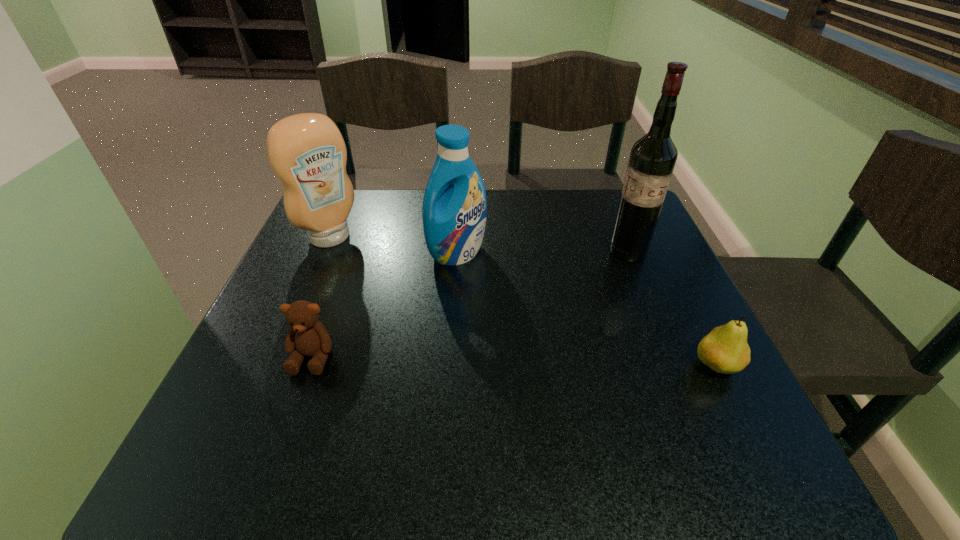
Identify which object is the third nearest to the condiment. Please provide its 2D coordinates. Your answer should be formatted as a tuple, i.e. [(x, y)], where the tuple contains the x and y coordinates of a point satisfying the conditions above.

[(652, 159)]

Identify the location of vacant space that satisfies the following two spatial constraints: 1. on the front side of the condiment; 2. on the left side of the pear. The width and height of the screenshot is (960, 540). (276, 365).

You are a GUI agent. You are given a task and a screenshot of the screen. Output one action in this format:
    pyautogui.click(x=<x>, y=<y>)
    Task: Click on the vacant space that satisfies the following two spatial constraints: 1. on the front side of the pear; 2. on the left side of the condiment
    The width and height of the screenshot is (960, 540).
    Given the screenshot: What is the action you would take?
    pyautogui.click(x=276, y=365)